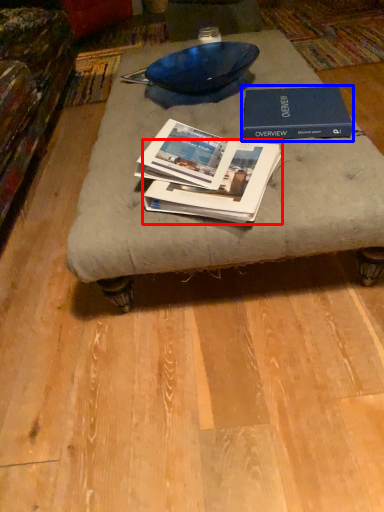
Question: Among these objects, which one is nearest to the camera, book (highlighted by a red box) or book (highlighted by a blue box)?

Choices:
 (A) book
 (B) book

Answer: (A)